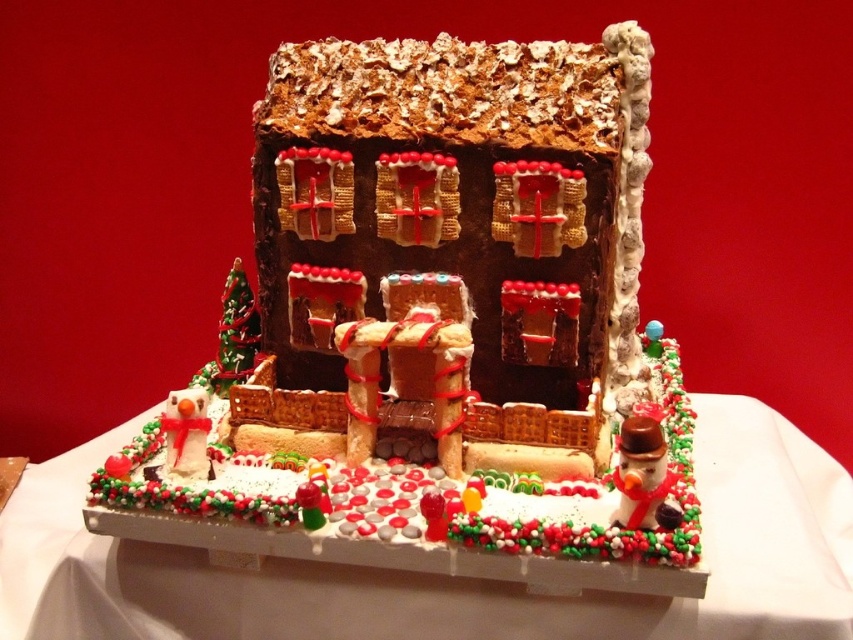
Is chocolate gingerbread house at center above white frosted cake at center?

Correct, chocolate gingerbread house at center is located above white frosted cake at center.

Does chocolate gingerbread house at center appear under white frosted cake at center?

No, chocolate gingerbread house at center is not below white frosted cake at center.

Describe the element at coordinates (436, 307) in the screenshot. This screenshot has height=640, width=853. I see `chocolate gingerbread house at center` at that location.

Identify the location of chocolate gingerbread house at center. The width and height of the screenshot is (853, 640). (436, 307).